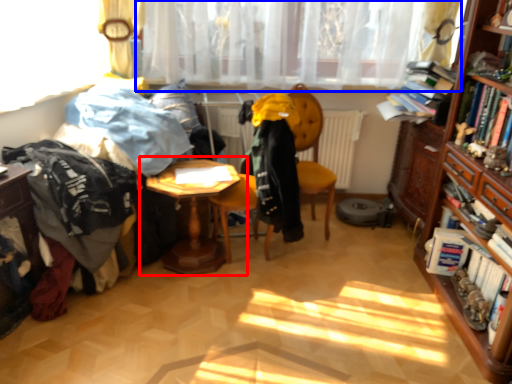
Question: Which object appears farthest to the camera in this image, table (highlighted by a red box) or curtain (highlighted by a blue box)?

Choices:
 (A) table
 (B) curtain

Answer: (B)